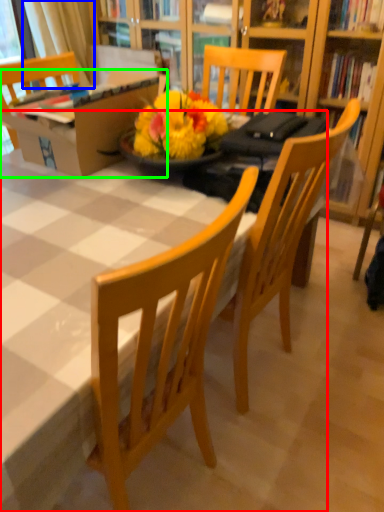
Question: Which is nearer to the desk (highlighted by a red box)? curtain (highlighted by a blue box) or box (highlighted by a green box).

Choices:
 (A) curtain
 (B) box

Answer: (B)